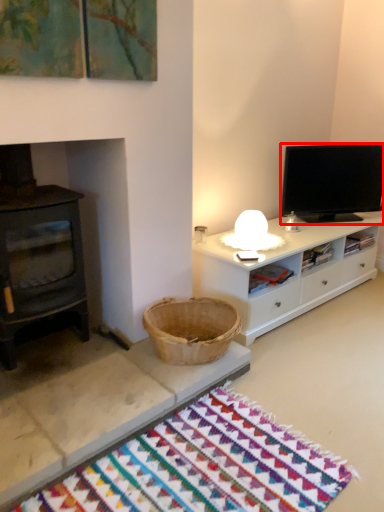
Question: From the image's perspective, where is television (annotated by the red box) located relative to mat?

Choices:
 (A) below
 (B) above

Answer: (B)